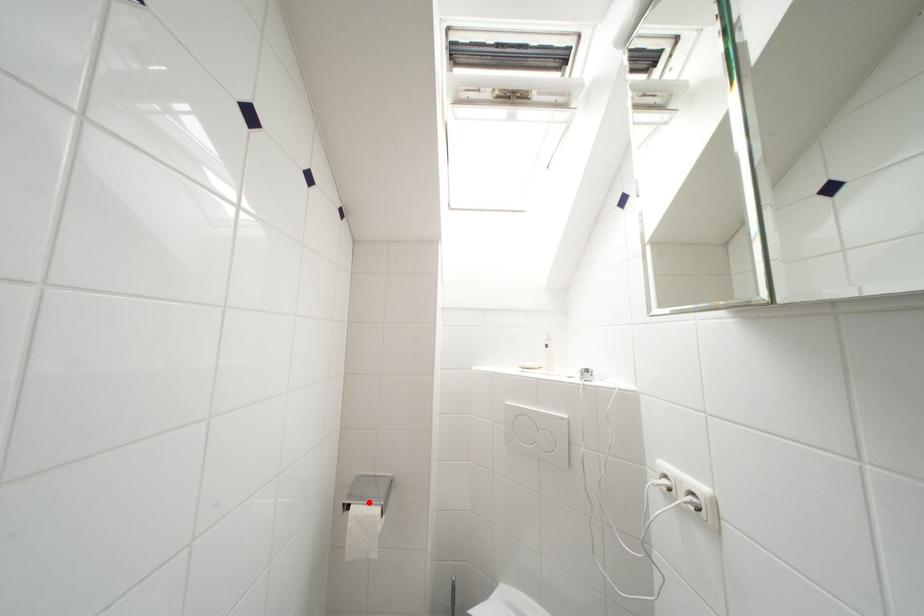
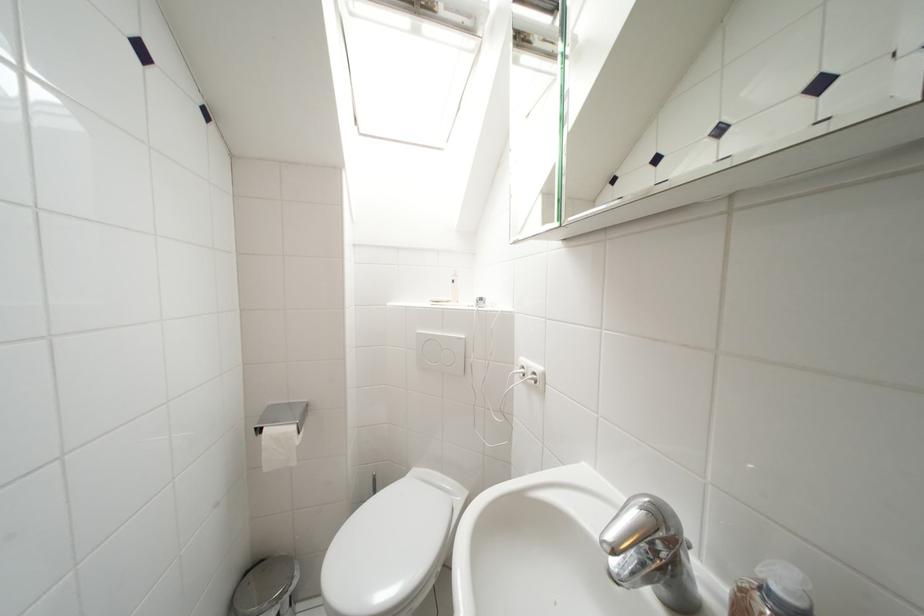
In the second image, find the point that corresponds to the highlighted location in the first image.

(283, 424)